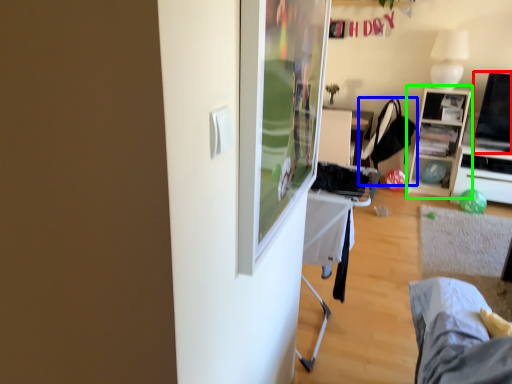
Question: Considering the real-world distances, which object is closest to television (highlighted by a red box)? chair (highlighted by a blue box) or cabinetry (highlighted by a green box).

Choices:
 (A) chair
 (B) cabinetry

Answer: (B)